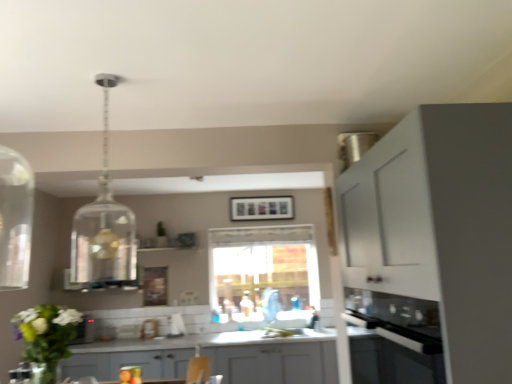
The width and height of the screenshot is (512, 384). What are the coordinates of `vacant region above matte black picture frame at center (from a real-world perspective)` in the screenshot? It's located at (260, 193).